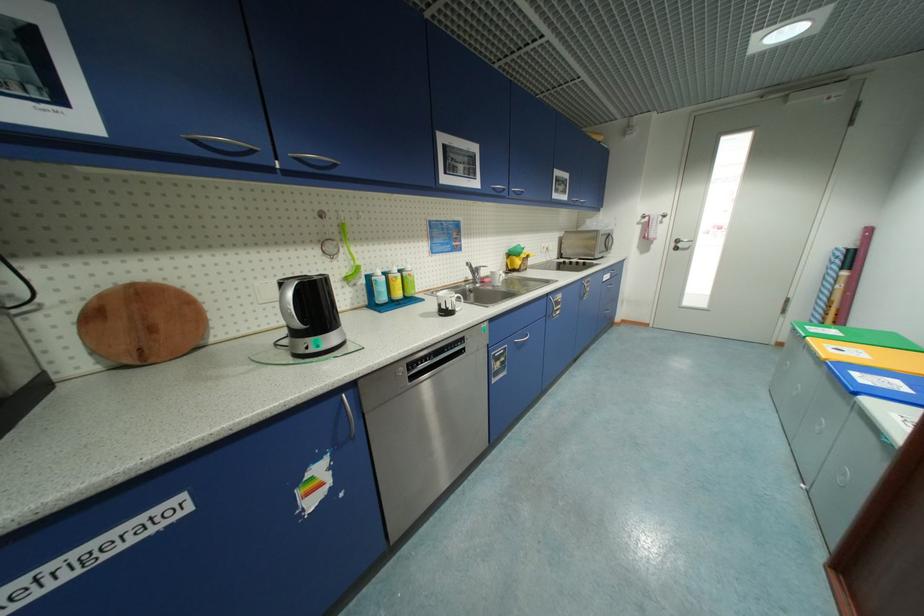
Describe the element at coordinates (346, 238) in the screenshot. This screenshot has height=616, width=924. I see `a green cleaning brush handle` at that location.